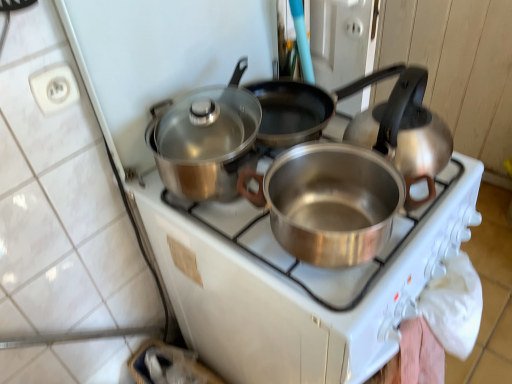
Question: Considering the relative sizes of matte white stove at center and satin silver kettle at right in the image provided, is matte white stove at center wider than satin silver kettle at right?

Choices:
 (A) no
 (B) yes

Answer: (A)

Question: From the image's perspective, is matte white stove at center beneath satin silver kettle at right?

Choices:
 (A) yes
 (B) no

Answer: (A)

Question: Is matte white stove at center shorter than satin silver kettle at right?

Choices:
 (A) yes
 (B) no

Answer: (B)

Question: From a real-world perspective, is matte white stove at center under satin silver kettle at right?

Choices:
 (A) yes
 (B) no

Answer: (A)

Question: Does matte white stove at center have a larger size compared to satin silver kettle at right?

Choices:
 (A) no
 (B) yes

Answer: (B)

Question: From a real-world perspective, is silver metallic pot at center positioned above or below shiny metallic pot at center?

Choices:
 (A) above
 (B) below

Answer: (B)

Question: In terms of height, does silver metallic pot at center look taller or shorter compared to shiny metallic pot at center?

Choices:
 (A) tall
 (B) short

Answer: (A)

Question: From the image's perspective, is silver metallic pot at center above or below shiny metallic pot at center?

Choices:
 (A) above
 (B) below

Answer: (B)

Question: Would you say silver metallic pot at center is inside or outside shiny metallic pot at center?

Choices:
 (A) outside
 (B) inside

Answer: (A)

Question: Is matte white stove at center to the left or to the right of shiny metallic pot at center in the image?

Choices:
 (A) left
 (B) right

Answer: (A)

Question: From the image's perspective, relative to shiny metallic pot at center, is matte white stove at center above or below?

Choices:
 (A) above
 (B) below

Answer: (B)

Question: Is matte white stove at center inside or outside of shiny metallic pot at center?

Choices:
 (A) inside
 (B) outside

Answer: (B)

Question: Does point (93, 357) appear closer or farther from the camera than point (181, 144)?

Choices:
 (A) closer
 (B) farther

Answer: (B)

Question: Do you think matte white stove at center is within silver metallic pot at center, or outside of it?

Choices:
 (A) outside
 (B) inside

Answer: (A)

Question: Considering the positions of matte white stove at center and silver metallic pot at center in the image, is matte white stove at center wider or thinner than silver metallic pot at center?

Choices:
 (A) thin
 (B) wide

Answer: (A)